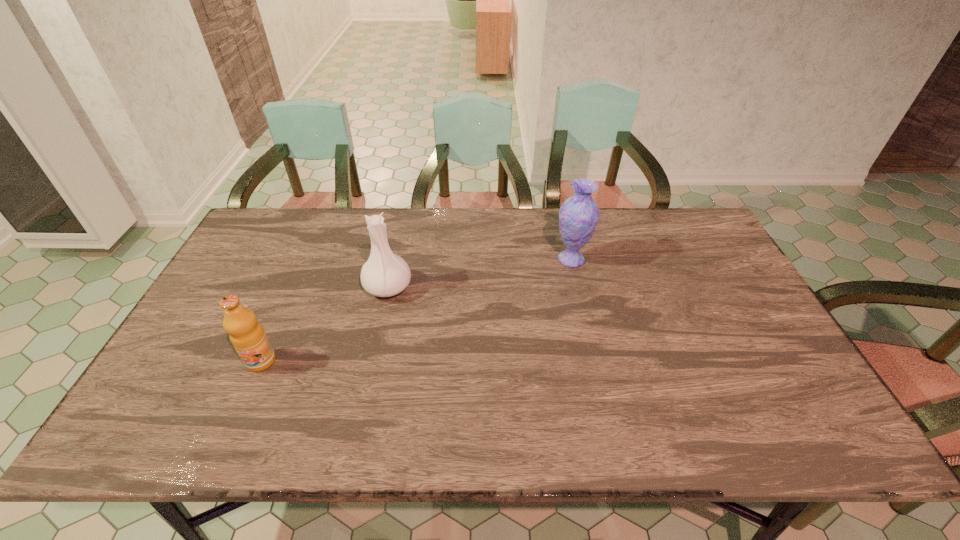
Locate an element on the screen. The width and height of the screenshot is (960, 540). vacant space at the left edge is located at coordinates (198, 351).

You are a GUI agent. You are given a task and a screenshot of the screen. Output one action in this format:
    pyautogui.click(x=<x>, y=<y>)
    Task: Click on the free space at the right edge of the desktop
    The image size is (960, 540).
    Given the screenshot: What is the action you would take?
    pyautogui.click(x=704, y=300)

Image resolution: width=960 pixels, height=540 pixels. In the image, there is a desktop. In order to click on free space at the far left corner in this screenshot , I will do `click(257, 232)`.

In the image, there is a desktop. Identify the location of free space at the far right corner. (690, 241).

Where is `vacant area at the near right corner of the desktop`? vacant area at the near right corner of the desktop is located at coordinates [x=778, y=412].

You are a GUI agent. You are given a task and a screenshot of the screen. Output one action in this format:
    pyautogui.click(x=<x>, y=<y>)
    Task: Click on the vacant space that is in between the fruit juice and the rightmost object
    
    Given the screenshot: What is the action you would take?
    pyautogui.click(x=416, y=310)

This screenshot has width=960, height=540. I want to click on vacant area that lies between the nearest object and the right vase, so click(416, 310).

Identify the location of vacant area that lies between the right vase and the second object from left to right. The height and width of the screenshot is (540, 960). click(x=480, y=273).

This screenshot has height=540, width=960. Find the location of `vacant space in between the rightmost object and the second object from right to left`. vacant space in between the rightmost object and the second object from right to left is located at coordinates (480, 273).

Identify the location of free space that is in between the nearest object and the rightmost object. This screenshot has height=540, width=960. click(x=416, y=310).